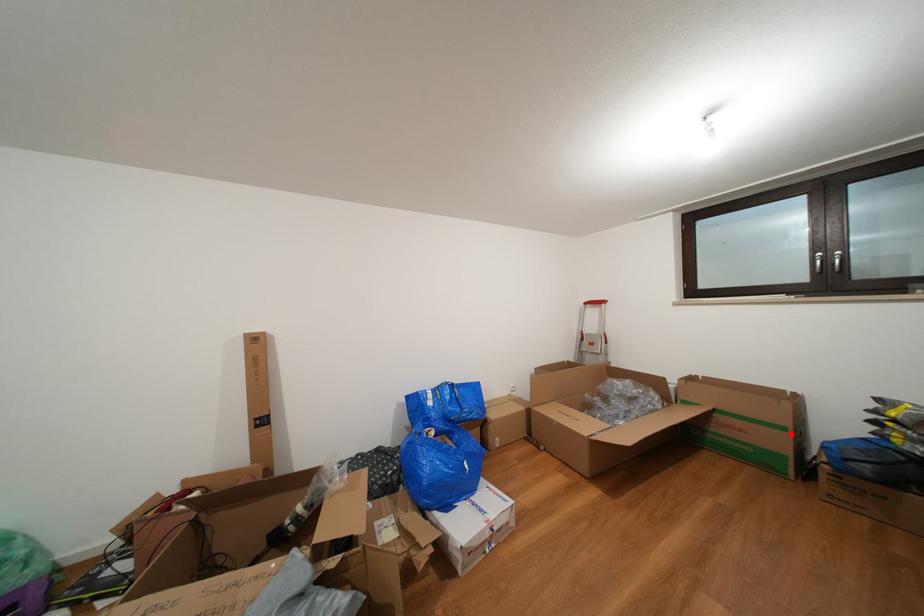
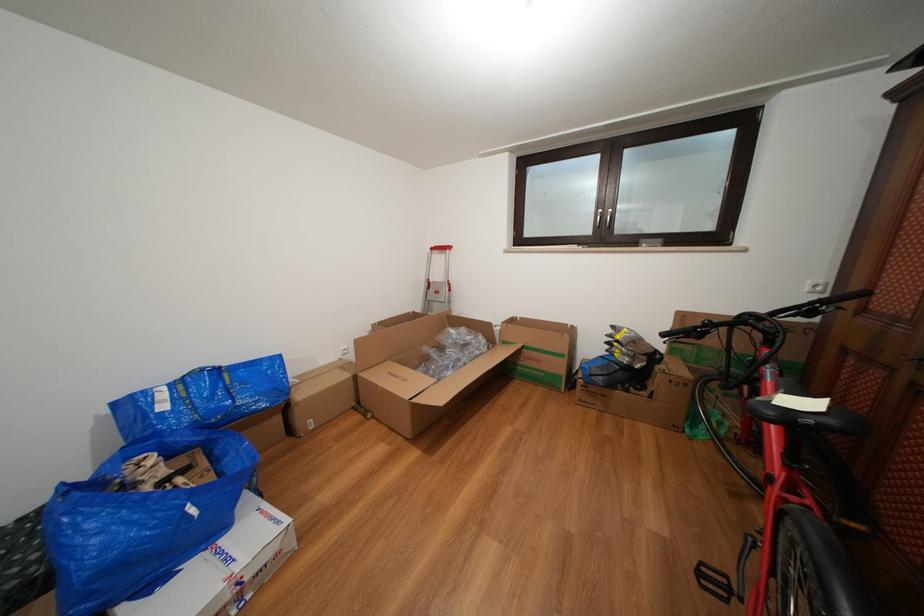
Question: I am providing you with two images of the same scene from different viewpoints. A red point is shown in image1. For the corresponding object point in image2, is it positioned nearer or farther from the camera?

Choices:
 (A) Nearer
 (B) Farther

Answer: (A)